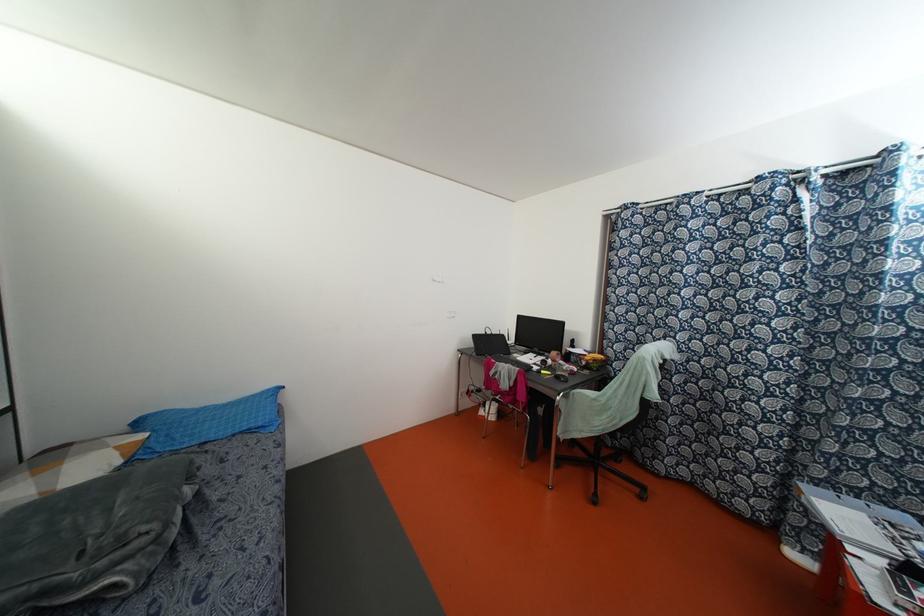
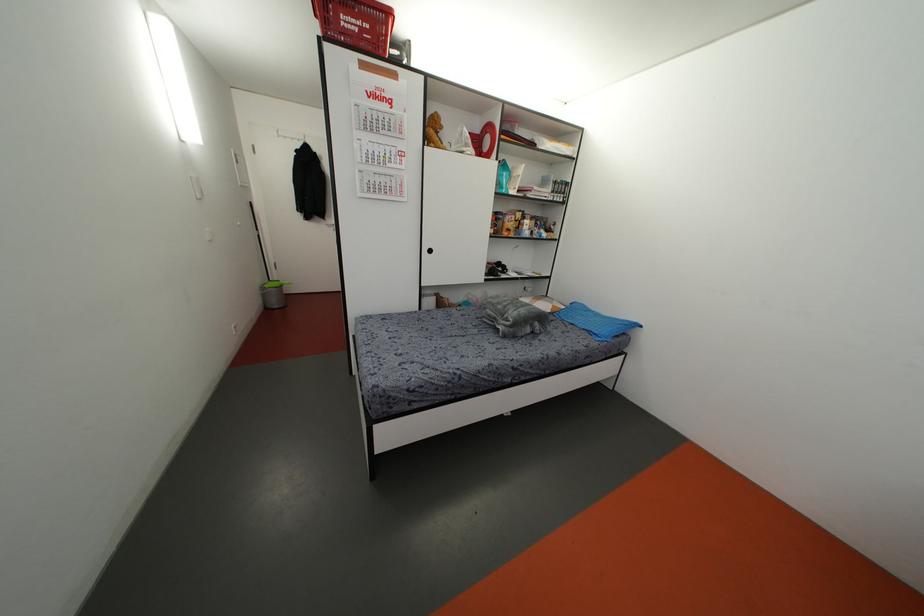
Where in the second image is the point corresponding to pixel 259 424 from the first image?

(596, 331)